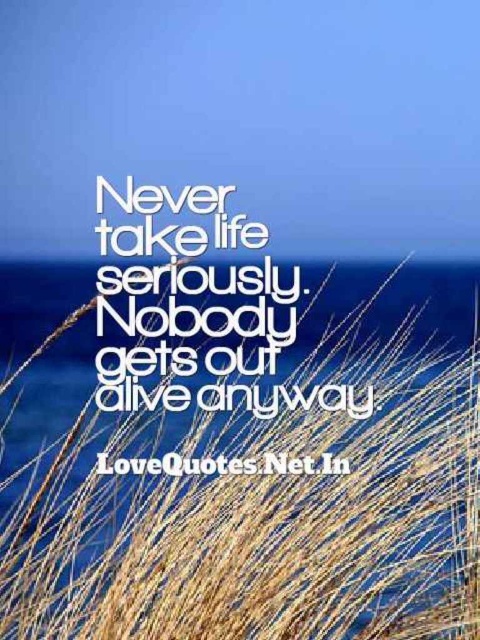
Find the location of a particular element. This screenshot has height=640, width=480. brown dry grass at center is located at coordinates click(240, 458).

Is point (36, 349) farther from viewer compared to point (139, 320)?

Yes, it is.

In order to click on brown dry grass at center in this screenshot , I will do `click(240, 458)`.

Does white paper at center appear over white text at center?

Indeed, white paper at center is positioned over white text at center.

Is point (121, 358) farther from viewer compared to point (141, 474)?

No, (121, 358) is closer to viewer.

At what (x,y) coordinates should I click in order to perform the action: click on white paper at center. Please return your answer as a coordinate pair (x, y). The width and height of the screenshot is (480, 640). Looking at the image, I should click on (199, 298).

Does brown dry grass at center have a lesser height compared to white text at center?

In fact, brown dry grass at center may be taller than white text at center.

Is brown dry grass at center bigger than white text at center?

Yes.

This screenshot has height=640, width=480. What do you see at coordinates (240, 458) in the screenshot?
I see `brown dry grass at center` at bounding box center [240, 458].

This screenshot has height=640, width=480. What are the coordinates of `brown dry grass at center` in the screenshot? It's located at (240, 458).